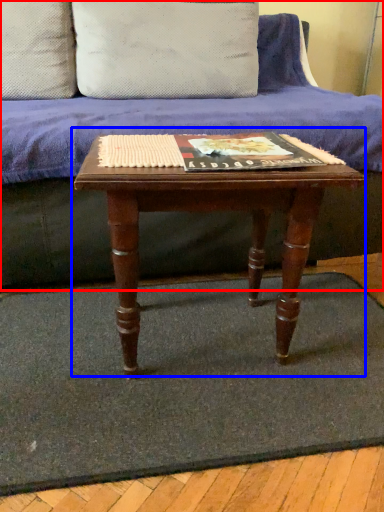
Question: Which of the following is the farthest to the observer, studio couch (highlighted by a red box) or table (highlighted by a blue box)?

Choices:
 (A) studio couch
 (B) table

Answer: (A)